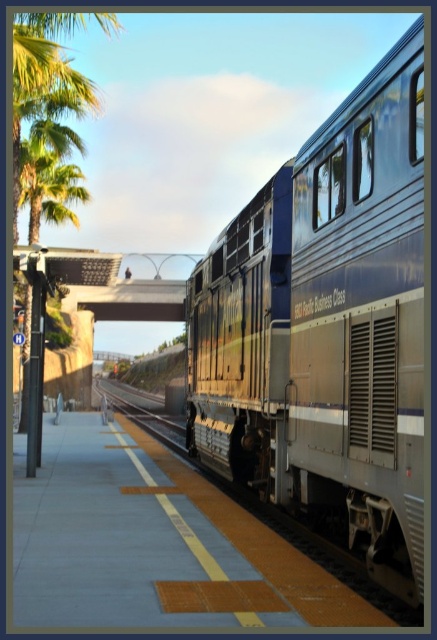
Question: Which point is closer to the camera taking this photo?

Choices:
 (A) (243, 282)
 (B) (110, 385)

Answer: (A)

Question: Can you confirm if smooth concrete platform at center is smaller than metal train track at center?

Choices:
 (A) no
 (B) yes

Answer: (B)

Question: Can you confirm if smooth concrete platform at center is bigger than metal train track at center?

Choices:
 (A) no
 (B) yes

Answer: (A)

Question: Estimate the real-world distances between objects in this image. Which object is closer to the smooth concrete platform at center?

Choices:
 (A) metallic blue train at right
 (B) metal train track at center

Answer: (A)

Question: Which of these objects is positioned closest to the metallic blue train at right?

Choices:
 (A) smooth concrete platform at center
 (B) metal train track at center

Answer: (A)

Question: Is metallic blue train at right to the right of smooth concrete platform at center from the viewer's perspective?

Choices:
 (A) no
 (B) yes

Answer: (B)